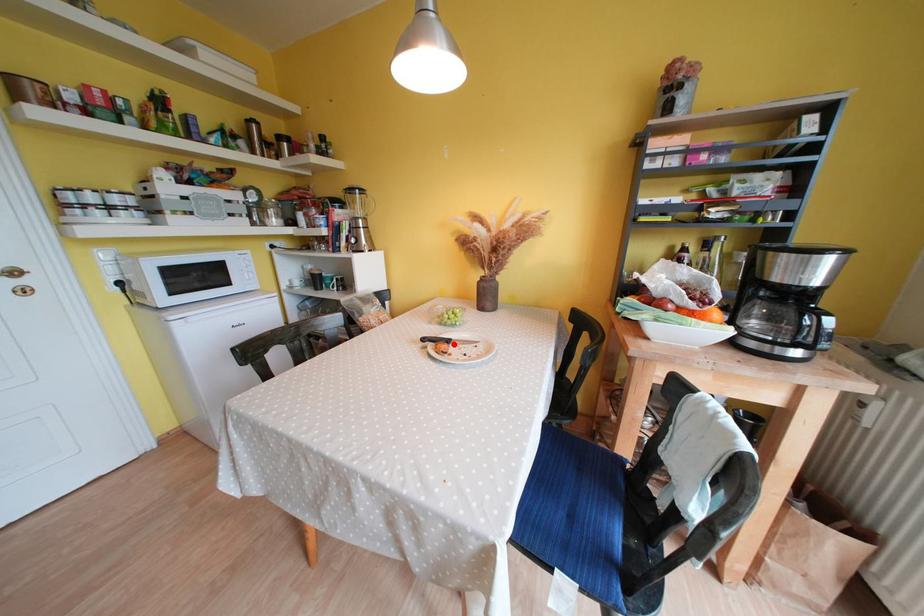
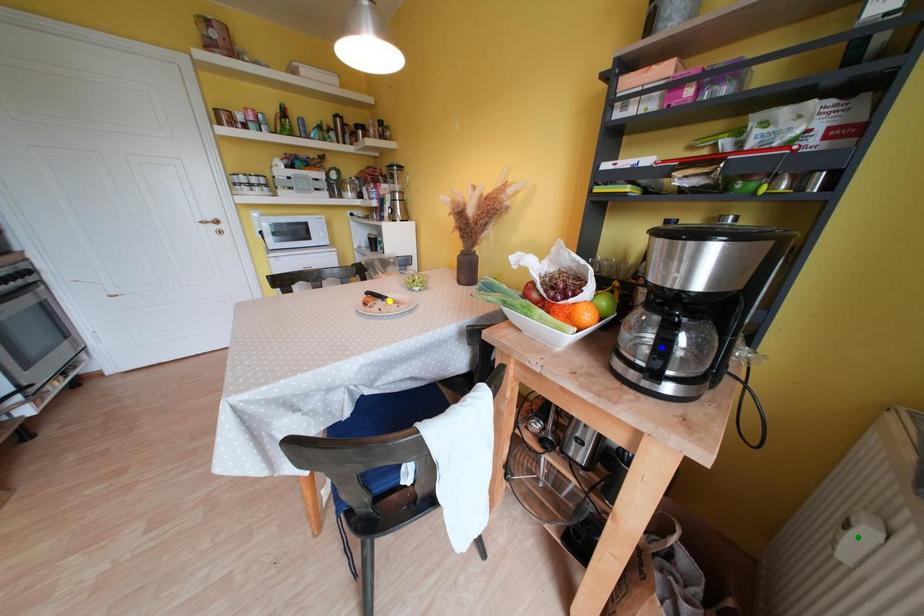
Question: I am providing you with two images of the same scene from different viewpoints. A red point is marked on the first image. You are given multiple points on the second image. Which point in image 2 is actually the same real-world point as the red point in image 1?

Choices:
 (A) green point
 (B) yellow point
 (C) blue point

Answer: (B)